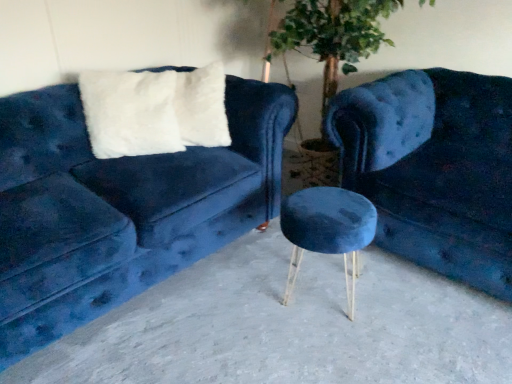
This screenshot has width=512, height=384. In order to click on vacant area that lies between velvet blue stool at center and velvet blue couch at center, the first studio couch viewed from the right in this screenshot , I will do `click(410, 308)`.